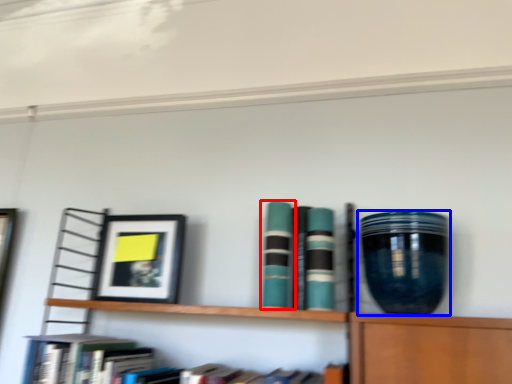
Question: Among these objects, which one is nearest to the camera, book (highlighted by a red box) or vase (highlighted by a blue box)?

Choices:
 (A) book
 (B) vase

Answer: (B)